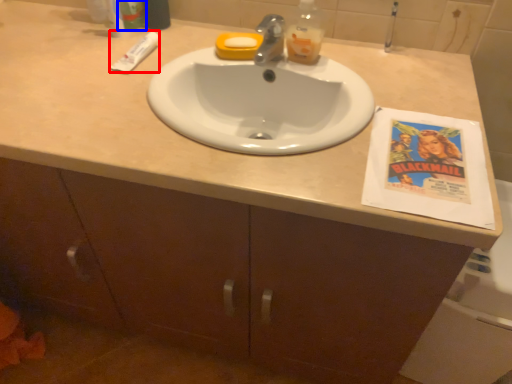
Question: Among these objects, which one is nearest to the camera, toothpaste (highlighted by a red box) or toiletry (highlighted by a blue box)?

Choices:
 (A) toothpaste
 (B) toiletry

Answer: (A)